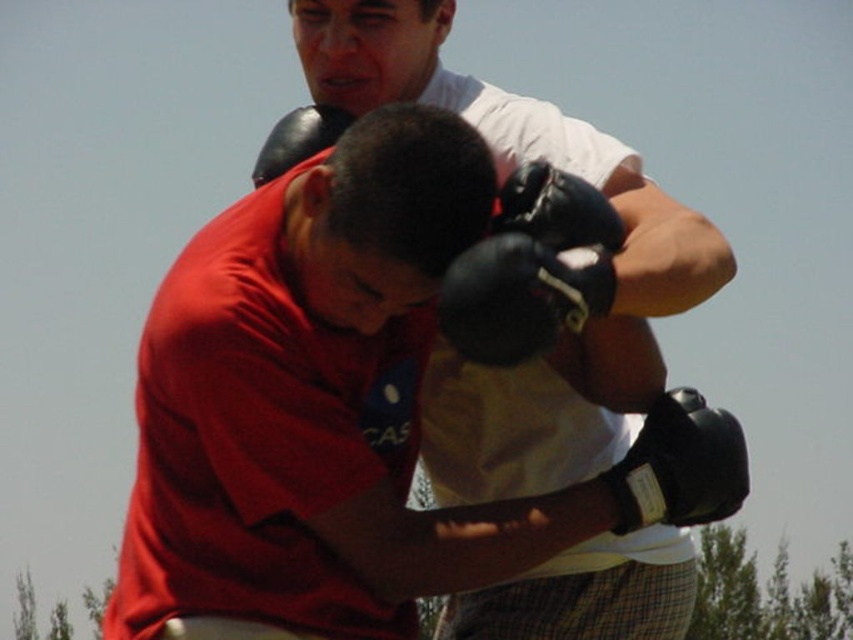
Between matte black gloves at upper center and black leather boxing glove at center, which one is positioned higher?

black leather boxing glove at center is above.

The image size is (853, 640). Describe the element at coordinates (525, 260) in the screenshot. I see `matte black gloves at upper center` at that location.

You are a GUI agent. You are given a task and a screenshot of the screen. Output one action in this format:
    pyautogui.click(x=<x>, y=<y>)
    Task: Click on the matte black gloves at upper center
    
    Given the screenshot: What is the action you would take?
    pyautogui.click(x=525, y=260)

How much distance is there between matte black gloves at upper center and black synthetic glove at lower right?

matte black gloves at upper center and black synthetic glove at lower right are 8.79 feet apart from each other.

Between point (606, 545) and point (693, 502), which one is positioned in front?

Point (693, 502) is more forward.

Does point (529, 620) lie in front of point (621, 481)?

No.

At what (x,y) coordinates should I click in order to perform the action: click on matte black gloves at upper center. Please return your answer as a coordinate pair (x, y). The image size is (853, 640). Looking at the image, I should click on (525, 260).

Can you confirm if black leather boxing glove at center is smaller than black synthetic glove at lower right?

Incorrect, black leather boxing glove at center is not smaller in size than black synthetic glove at lower right.

Based on the photo, is black leather boxing glove at center to the left of black synthetic glove at lower right from the viewer's perspective?

Correct, you'll find black leather boxing glove at center to the left of black synthetic glove at lower right.

Locate an element on the screen. black leather boxing glove at center is located at coordinates (531, 268).

The height and width of the screenshot is (640, 853). I want to click on black leather boxing glove at center, so click(x=531, y=268).